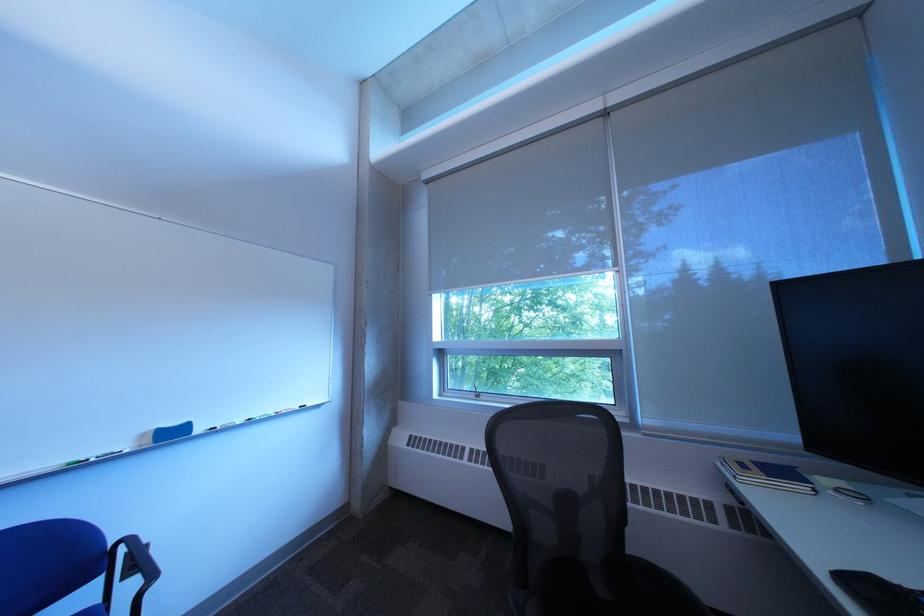
Which object does [165,434] point to?

This point indicates the blue whiteboard eraser.